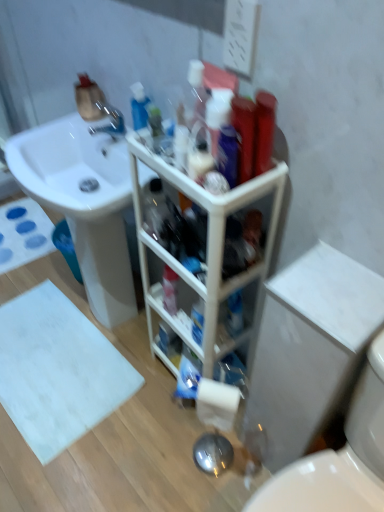
Question: Considering the relative sizes of white matte toilet paper at lower center and white glossy sink at upper left in the image provided, is white matte toilet paper at lower center taller than white glossy sink at upper left?

Choices:
 (A) no
 (B) yes

Answer: (A)

Question: Does white matte toilet paper at lower center lie in front of white glossy sink at upper left?

Choices:
 (A) no
 (B) yes

Answer: (B)

Question: Is white matte toilet paper at lower center facing towards white glossy sink at upper left?

Choices:
 (A) no
 (B) yes

Answer: (A)

Question: Is white matte toilet paper at lower center to the right of white glossy sink at upper left from the viewer's perspective?

Choices:
 (A) no
 (B) yes

Answer: (B)

Question: From the image's perspective, does white matte toilet paper at lower center appear lower than white glossy sink at upper left?

Choices:
 (A) yes
 (B) no

Answer: (A)

Question: Can you confirm if white matte toilet paper at lower center is smaller than white glossy sink at upper left?

Choices:
 (A) no
 (B) yes

Answer: (B)

Question: From a real-world perspective, is white matte toilet paper at lower center on white plastic cabinet at center?

Choices:
 (A) no
 (B) yes

Answer: (A)

Question: Does white matte toilet paper at lower center come in front of white plastic cabinet at center?

Choices:
 (A) yes
 (B) no

Answer: (B)

Question: Does white matte toilet paper at lower center have a smaller size compared to white plastic cabinet at center?

Choices:
 (A) yes
 (B) no

Answer: (A)

Question: Is white matte toilet paper at lower center wider than white plastic cabinet at center?

Choices:
 (A) yes
 (B) no

Answer: (B)

Question: From the image's perspective, is white matte toilet paper at lower center above white plastic cabinet at center?

Choices:
 (A) no
 (B) yes

Answer: (A)

Question: Is white matte toilet paper at lower center positioned with its back to white plastic cabinet at center?

Choices:
 (A) yes
 (B) no

Answer: (A)

Question: Considering the relative sizes of white matte bath mat at lower left, which is the first bath mat from top to bottom, and white matte toilet paper at lower center in the image provided, is white matte bath mat at lower left, which is the first bath mat from top to bottom, shorter than white matte toilet paper at lower center?

Choices:
 (A) yes
 (B) no

Answer: (A)